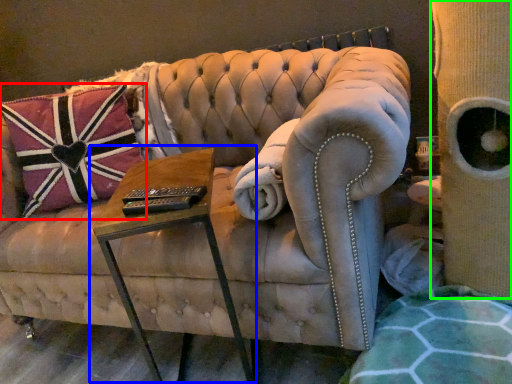
Question: Considering the real-world distances, which object is farthest from pillow (highlighted by a red box)? table (highlighted by a blue box) or side (highlighted by a green box)?

Choices:
 (A) table
 (B) side

Answer: (B)